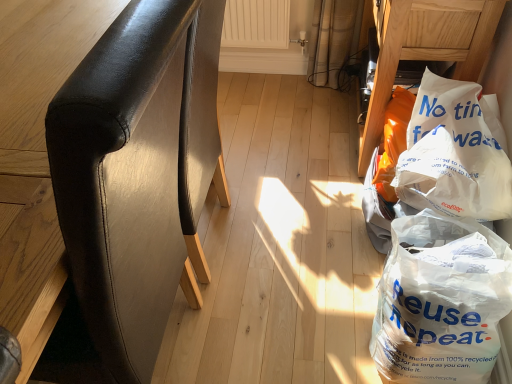
Question: From the image's perspective, is white plastic bag at lower right, which is the second plastic bag from top to bottom, beneath white plastic bag at lower right, the second furniture when ordered from left to right?

Choices:
 (A) yes
 (B) no

Answer: (A)

Question: From the image's perspective, is white plastic bag at lower right, positioned as the 1th plastic bag in bottom-to-top order, above white plastic bag at lower right, the second furniture when ordered from left to right?

Choices:
 (A) yes
 (B) no

Answer: (B)

Question: Is white plastic bag at lower right, positioned as the 1th plastic bag in bottom-to-top order, outside white plastic bag at lower right, the second furniture when ordered from left to right?

Choices:
 (A) yes
 (B) no

Answer: (A)

Question: From a real-world perspective, does white plastic bag at lower right, which is the second plastic bag from top to bottom, stand above white plastic bag at lower right, the second furniture when ordered from left to right?

Choices:
 (A) yes
 (B) no

Answer: (B)

Question: Does white plastic bag at lower right, positioned as the 1th plastic bag in bottom-to-top order, come behind white plastic bag at lower right, the second furniture when ordered from left to right?

Choices:
 (A) yes
 (B) no

Answer: (B)

Question: From the image's perspective, relative to white plastic bag at lower right, positioned as the 1th plastic bag in bottom-to-top order, is white paper bag at lower right, the second plastic bag when ordered from bottom to top, above or below?

Choices:
 (A) below
 (B) above

Answer: (B)

Question: Is white paper bag at lower right, which is the 1th plastic bag in top-to-bottom order, bigger or smaller than white plastic bag at lower right, which is the second plastic bag from top to bottom?

Choices:
 (A) big
 (B) small

Answer: (B)

Question: From a real-world perspective, relative to white plastic bag at lower right, positioned as the 1th plastic bag in bottom-to-top order, is white paper bag at lower right, the second plastic bag when ordered from bottom to top, vertically above or below?

Choices:
 (A) below
 (B) above

Answer: (B)

Question: Is white paper bag at lower right, which is the 1th plastic bag in top-to-bottom order, situated inside white plastic bag at lower right, positioned as the 1th plastic bag in bottom-to-top order, or outside?

Choices:
 (A) outside
 (B) inside

Answer: (A)

Question: In terms of height, does white plastic bag at lower right, the second furniture when ordered from left to right, look taller or shorter compared to black leather chair at left, which ranks as the second furniture in right-to-left order?

Choices:
 (A) tall
 (B) short

Answer: (B)

Question: From the image's perspective, is white plastic bag at lower right, the second furniture when ordered from left to right, located above or below black leather chair at left, the first furniture from the left?

Choices:
 (A) above
 (B) below

Answer: (A)

Question: Choose the correct answer: Is white plastic bag at lower right, which is the 1th furniture in right-to-left order, inside black leather chair at left, which ranks as the second furniture in right-to-left order, or outside it?

Choices:
 (A) inside
 (B) outside

Answer: (B)

Question: Relative to black leather chair at left, which ranks as the second furniture in right-to-left order, is white plastic bag at lower right, the second furniture when ordered from left to right, in front or behind?

Choices:
 (A) front
 (B) behind

Answer: (B)

Question: In terms of size, does white plastic bag at lower right, which is the second plastic bag from top to bottom, appear bigger or smaller than black leather chair at left, the first furniture from the left?

Choices:
 (A) big
 (B) small

Answer: (B)

Question: From their relative heights in the image, would you say white plastic bag at lower right, which is the second plastic bag from top to bottom, is taller or shorter than black leather chair at left, which ranks as the second furniture in right-to-left order?

Choices:
 (A) tall
 (B) short

Answer: (B)